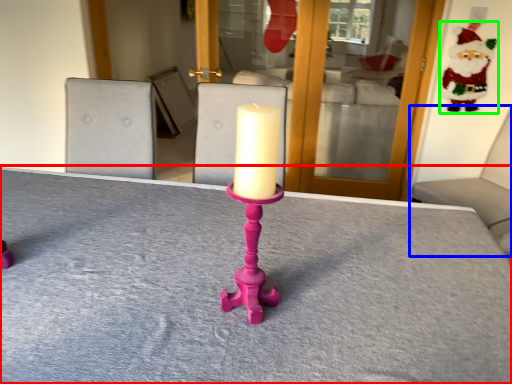
Question: Estimate the real-world distances between objects in this image. Which object is closer to table (highlighted by a red box), furniture (highlighted by a blue box) or santa claus (highlighted by a green box)?

Choices:
 (A) furniture
 (B) santa claus

Answer: (A)